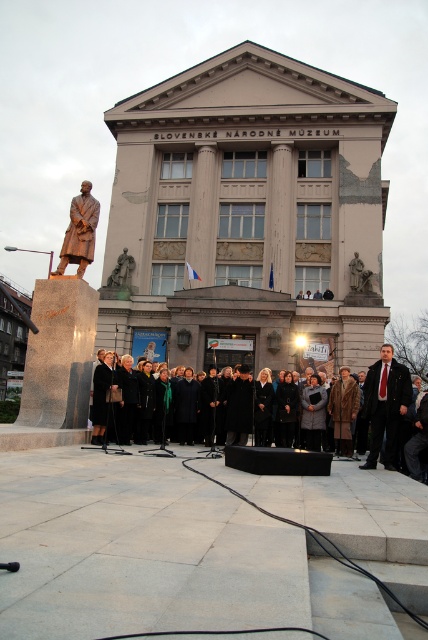
You are a tourist standing in front of the Slovak National Museum. You see two bronze statues. One is labeled as the bronze statue at left and the other as the bronze statue at center. According to their positions, which one is actually located more to the left side?

The bronze statue at center is actually located more to the left side because the bronze statue at left is positioned to the right of it.

You are a tour guide explaining the sculptures in front of the Slovak National Museum. You mention both the bronze statue at left and bronze statue at center. Which one is wider?

The bronze statue at left is wider than the bronze statue at center.